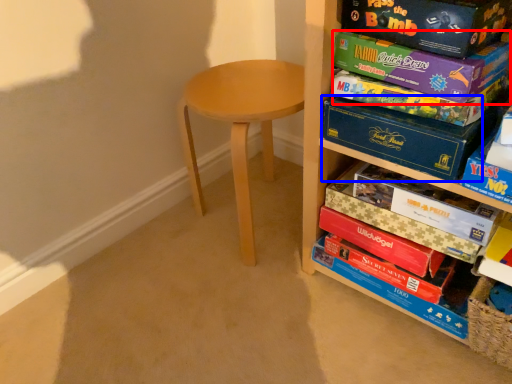
Question: Which object appears farthest to the camera in this image, paperback book (highlighted by a red box) or paperback book (highlighted by a blue box)?

Choices:
 (A) paperback book
 (B) paperback book

Answer: (B)